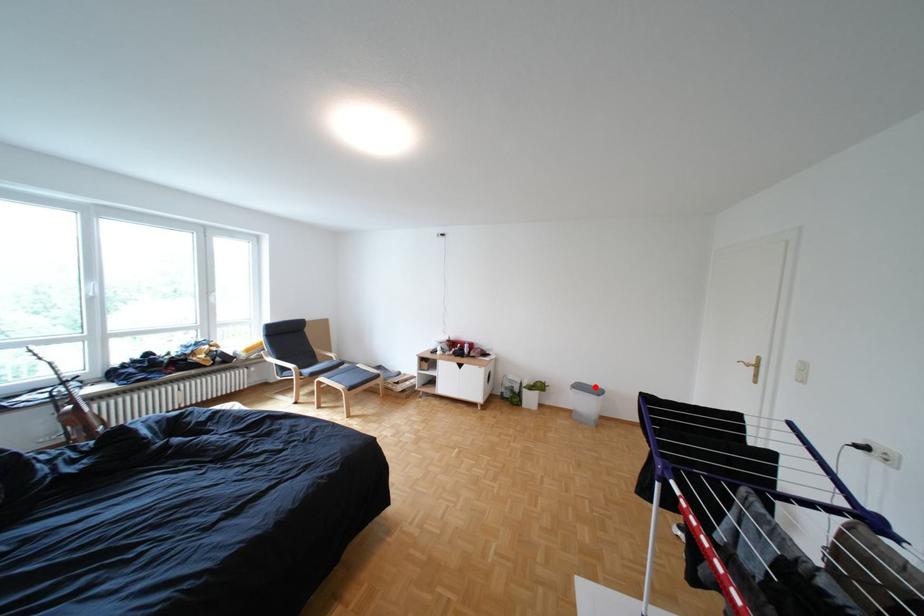
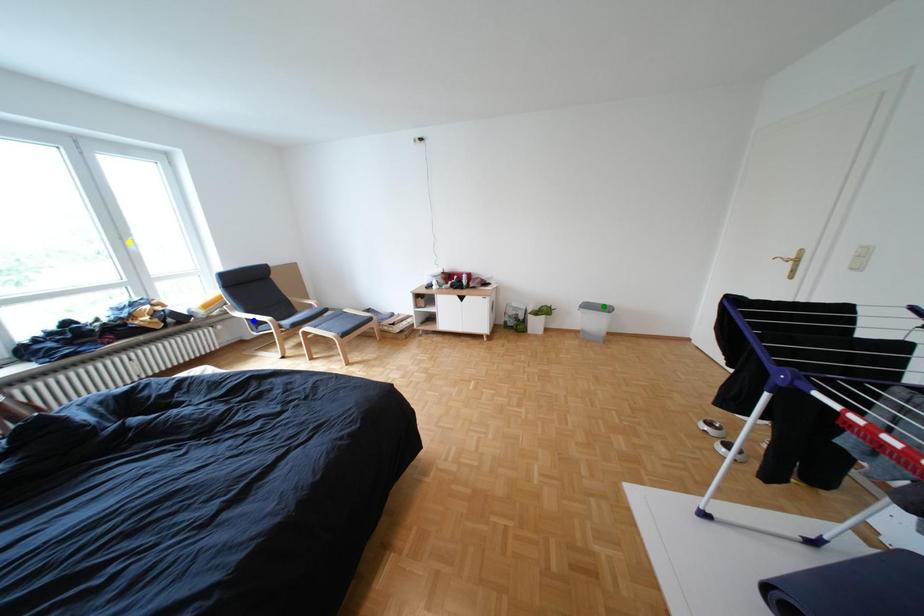
Question: I am providing you with two images of the same scene from different viewpoints. A red point is marked on the first image. You are given multiple points on the second image. Which point in image 2 represents the same 3d spot as the red point in image 1?

Choices:
 (A) yellow point
 (B) blue point
 (C) green point

Answer: (C)